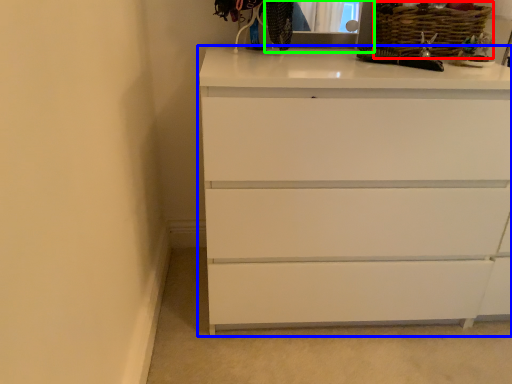
Question: Which object is the closest to the basket (highlighted by a red box)? Choose among these: chest of drawers (highlighted by a blue box) or medicine cabinet (highlighted by a green box).

Choices:
 (A) chest of drawers
 (B) medicine cabinet

Answer: (B)